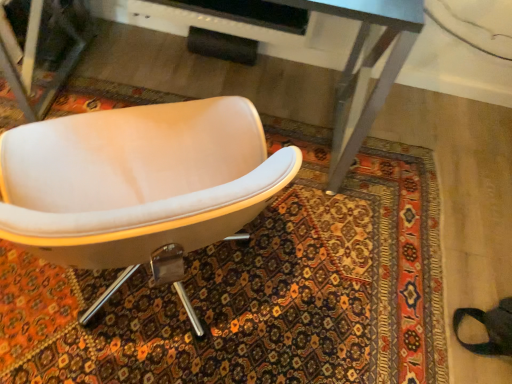
Question: From a real-world perspective, is metallic gray desk at center positioned under white leather chair at center based on gravity?

Choices:
 (A) no
 (B) yes

Answer: (B)

Question: Is metallic gray desk at center surrounding white leather chair at center?

Choices:
 (A) yes
 (B) no

Answer: (B)

Question: Are metallic gray desk at center and white leather chair at center beside each other?

Choices:
 (A) yes
 (B) no

Answer: (B)

Question: From the image's perspective, does metallic gray desk at center appear higher than white leather chair at center?

Choices:
 (A) yes
 (B) no

Answer: (A)

Question: Is metallic gray desk at center at the right side of white leather chair at center?

Choices:
 (A) yes
 (B) no

Answer: (A)

Question: Is metallic gray desk at center positioned in front of white leather chair at center?

Choices:
 (A) yes
 (B) no

Answer: (B)

Question: Does white leather chair at center appear on the left side of metallic gray desk at center?

Choices:
 (A) yes
 (B) no

Answer: (A)

Question: Would you say white leather chair at center is a long distance from metallic gray desk at center?

Choices:
 (A) no
 (B) yes

Answer: (A)

Question: From a real-world perspective, is white leather chair at center positioned under metallic gray desk at center based on gravity?

Choices:
 (A) yes
 (B) no

Answer: (B)

Question: Considering the relative sizes of white leather chair at center and metallic gray desk at center in the image provided, is white leather chair at center smaller than metallic gray desk at center?

Choices:
 (A) no
 (B) yes

Answer: (B)

Question: Considering the relative sizes of white leather chair at center and metallic gray desk at center in the image provided, is white leather chair at center thinner than metallic gray desk at center?

Choices:
 (A) yes
 (B) no

Answer: (B)

Question: Can you confirm if white leather chair at center is bigger than metallic gray desk at center?

Choices:
 (A) no
 (B) yes

Answer: (A)

Question: Is white leather chair at center situated inside metallic gray desk at center or outside?

Choices:
 (A) outside
 (B) inside

Answer: (A)